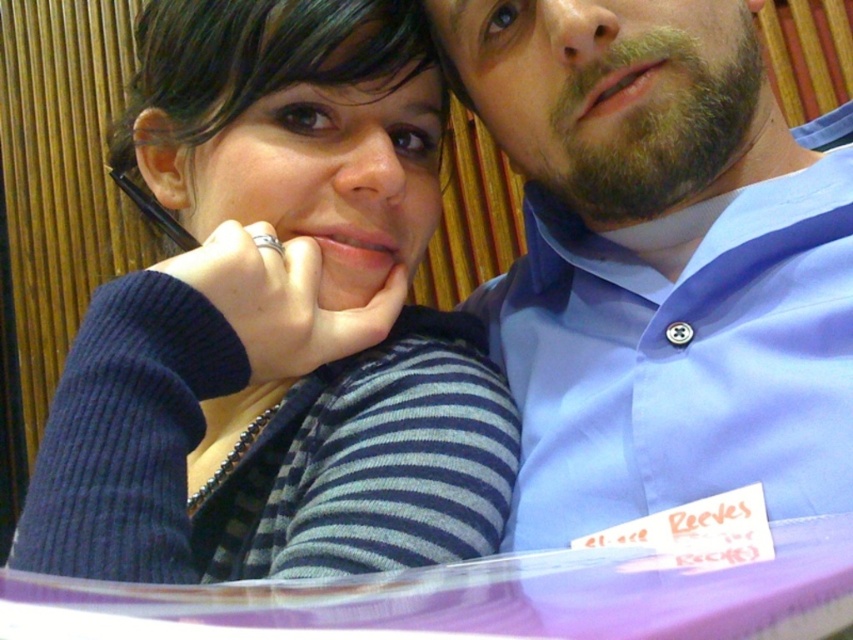
Is point (149, 397) behind point (593, 524)?

No, (149, 397) is in front of (593, 524).

How far apart are ribbed blue sweater at center and blue button-down shirt at upper right?

15.36 centimeters

Does point (375, 540) lie in front of point (573, 275)?

Yes, it is.

Locate an element on the screen. ribbed blue sweater at center is located at coordinates (276, 321).